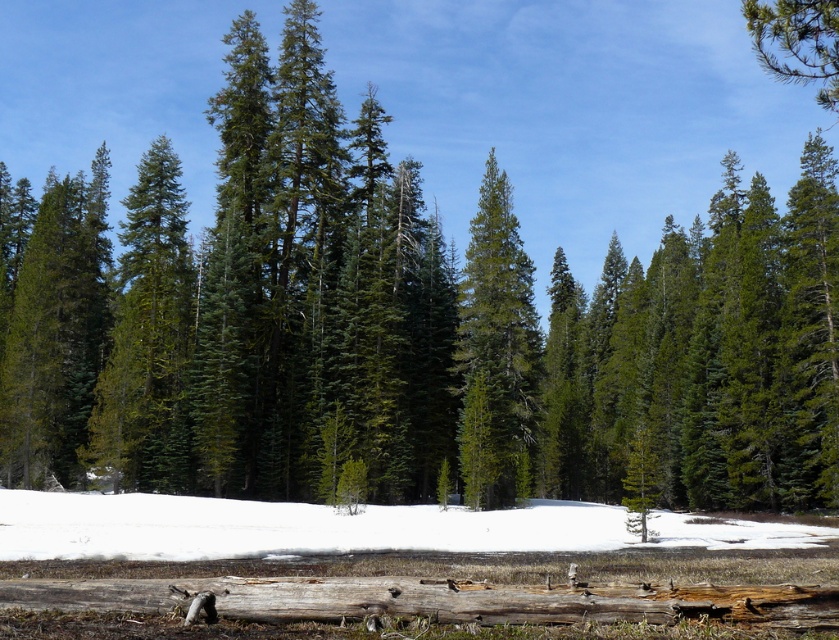
Is white fluffy snow at lower center to the right of green needle-like tree at upper right from the viewer's perspective?

Incorrect, white fluffy snow at lower center is not on the right side of green needle-like tree at upper right.

Is point (258, 529) closer to camera compared to point (780, 54)?

No, (258, 529) is further to viewer.

Between point (32, 548) and point (790, 58), which one is positioned behind?

The point (32, 548) is behind.

Identify the location of white fluffy snow at lower center. (345, 529).

Does green matte tree at center have a greater height compared to green needle-like tree at upper right?

Correct, green matte tree at center is much taller as green needle-like tree at upper right.

Does green matte tree at center appear over green needle-like tree at upper right?

Incorrect, green matte tree at center is not positioned above green needle-like tree at upper right.

Is point (529, 436) farther from viewer compared to point (817, 16)?

Yes, it is.

Where is `green matte tree at center`? green matte tree at center is located at coordinates (496, 352).

Measure the distance from white fluffy snow at lower center to green matte tree at center.

A distance of 12.04 meters exists between white fluffy snow at lower center and green matte tree at center.

Does white fluffy snow at lower center have a greater height compared to green matte tree at center?

No.

Where is `white fluffy snow at lower center`? white fluffy snow at lower center is located at coordinates (345, 529).